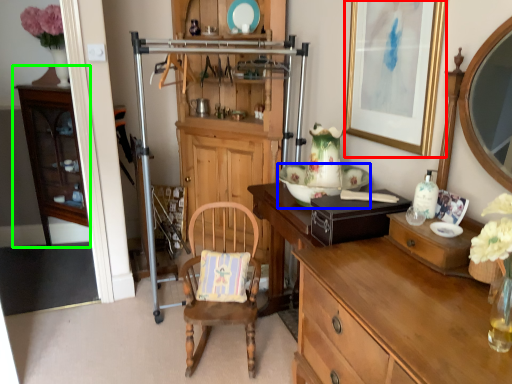
Question: Which is farther away from picture frame (highlighted by a red box)? plate (highlighted by a blue box) or cabinetry (highlighted by a green box)?

Choices:
 (A) plate
 (B) cabinetry

Answer: (B)